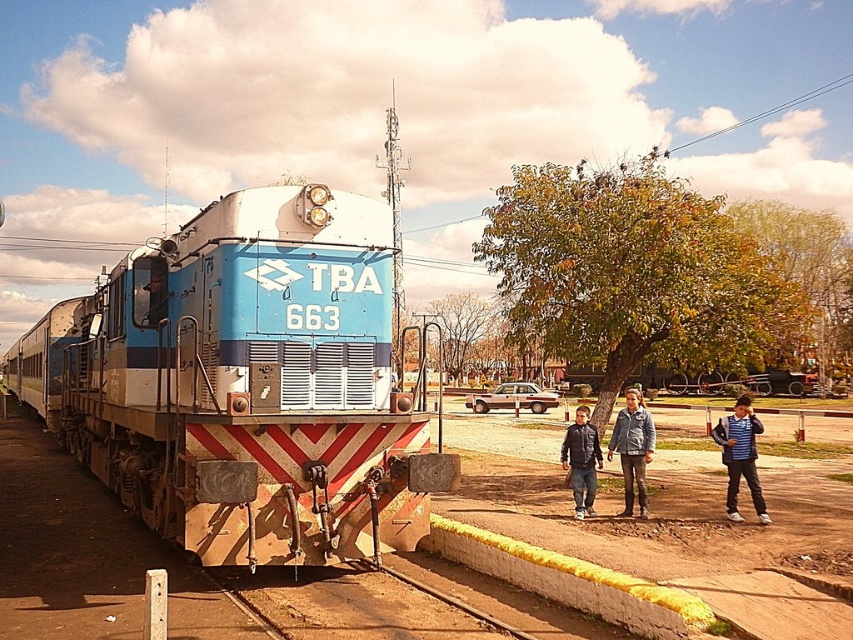
You are standing at the railway station and see the striped shirt at lower right and the leather jacket at center. Which person is closer to the tracks?

The striped shirt at lower right is to the right of the leather jacket at center, so the striped shirt at lower right is closer to the tracks.

In the scene shown: You are a photographer positioned at the railway station. You want to take a photo of the blue matte train at left and the matte brown sedan at center. Based on their positions, which object should you focus on first to ensure both are in sharp focus?

The blue matte train at left is closer to the viewer than the matte brown sedan at center. To ensure both are in sharp focus, you should focus on the blue matte train at left since it is closer, and the sedan will fall within the depth of field if properly set.

You are a delivery person who needs to move a package from the blue matte train at left to the matte brown sedan at center. The package is 2 meters long. Can you safely carry it between them without the package hitting anything? Explain your reasoning.

The blue matte train at left and the matte brown sedan at center are 26.06 meters apart from each other. Since the package is only 2 meters long, the distance between them is more than sufficient to safely carry the package without it hitting anything.